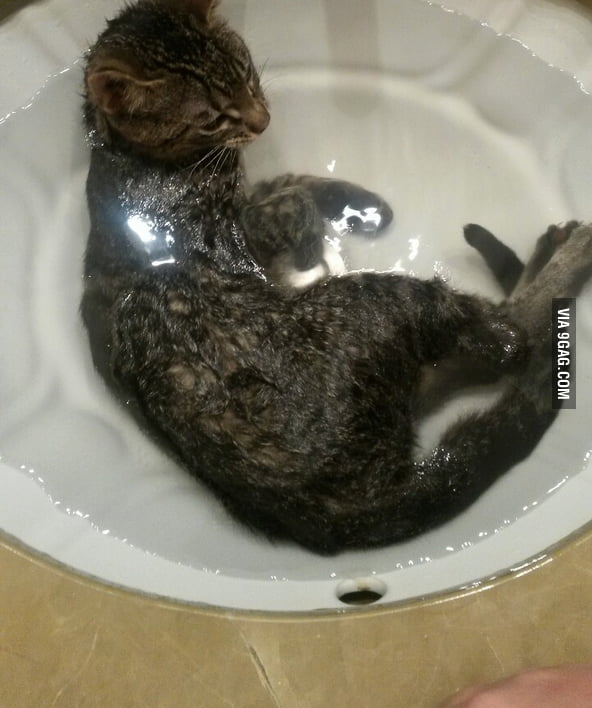
This screenshot has height=708, width=592. Identify the location of stone countertop. (417, 658).